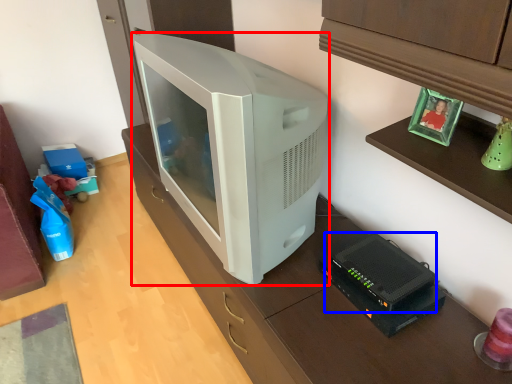
Question: Among these objects, which one is nearest to the camera, television (highlighted by a red box) or appliance (highlighted by a blue box)?

Choices:
 (A) television
 (B) appliance

Answer: (A)